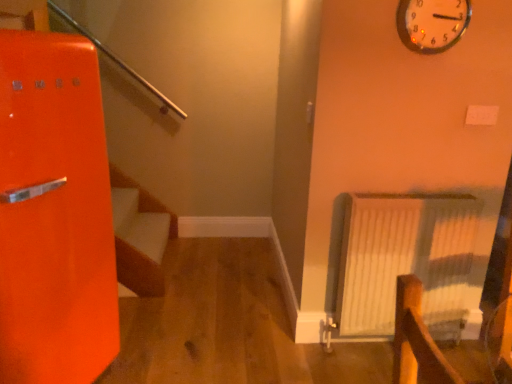
Question: Considering the positions of metallic silver clock at upper right and white textured radiator at right in the image, is metallic silver clock at upper right wider or thinner than white textured radiator at right?

Choices:
 (A) wide
 (B) thin

Answer: (B)

Question: In the image, is metallic silver clock at upper right positioned in front of or behind white textured radiator at right?

Choices:
 (A) front
 (B) behind

Answer: (A)

Question: Is metallic silver clock at upper right situated inside white textured radiator at right or outside?

Choices:
 (A) outside
 (B) inside

Answer: (A)

Question: Is point (432, 297) positioned closer to the camera than point (431, 44)?

Choices:
 (A) closer
 (B) farther

Answer: (B)

Question: Would you say white textured radiator at right is to the left or to the right of metallic silver clock at upper right in the picture?

Choices:
 (A) left
 (B) right

Answer: (A)

Question: From their relative heights in the image, would you say white textured radiator at right is taller or shorter than metallic silver clock at upper right?

Choices:
 (A) tall
 (B) short

Answer: (A)

Question: From a real-world perspective, is white textured radiator at right positioned above or below metallic silver clock at upper right?

Choices:
 (A) below
 (B) above

Answer: (A)